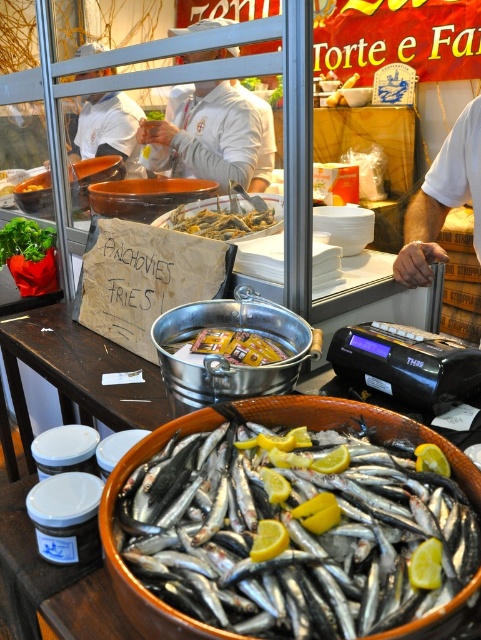
Question: Can you confirm if white cotton shirt at center is bigger than shiny silver anchovies at center?

Choices:
 (A) yes
 (B) no

Answer: (A)

Question: Which is nearer to the white cotton shirt at center?

Choices:
 (A) yellowish plastic packet at center
 (B) shiny silver anchovies at center
 (C) silver metallic fish at center

Answer: (B)

Question: Is white cotton shirt at center to the left of yellowish plastic packet at center from the viewer's perspective?

Choices:
 (A) yes
 (B) no

Answer: (A)

Question: Considering the real-world distances, which object is closest to the silver metallic fish at center?

Choices:
 (A) yellowish plastic packet at center
 (B) white cotton shirt at center

Answer: (A)

Question: Is silver metallic fish at center positioned at the back of white cotton shirt at center?

Choices:
 (A) no
 (B) yes

Answer: (A)

Question: Among these objects, which one is farthest from the camera?

Choices:
 (A) silver metallic fish at center
 (B) white cotton shirt at center
 (C) yellowish plastic packet at center

Answer: (B)